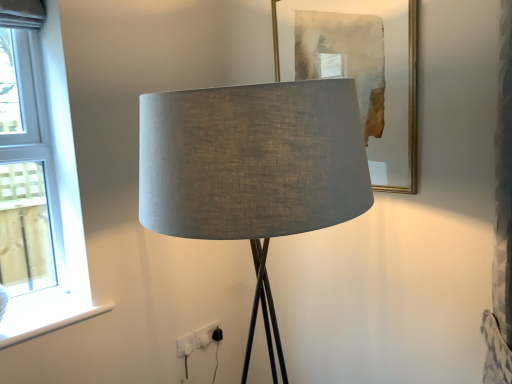
Question: Considering the relative sizes of white plastic electric outlet at lower center, acting as the 1th electric outlet starting from the front, and white smooth window sill at lower left in the image provided, is white plastic electric outlet at lower center, acting as the 1th electric outlet starting from the front, wider than white smooth window sill at lower left?

Choices:
 (A) yes
 (B) no

Answer: (B)

Question: Does white plastic electric outlet at lower center, the second electric outlet from the back, come in front of white smooth window sill at lower left?

Choices:
 (A) no
 (B) yes

Answer: (A)

Question: Is white plastic electric outlet at lower center, which ranks as the 2th electric outlet in right-to-left order, behind white smooth window sill at lower left?

Choices:
 (A) no
 (B) yes

Answer: (B)

Question: Is white plastic electric outlet at lower center, which ranks as the 2th electric outlet in right-to-left order, thinner than white smooth window sill at lower left?

Choices:
 (A) yes
 (B) no

Answer: (A)

Question: Considering the relative sizes of white plastic electric outlet at lower center, which ranks as the 2th electric outlet in right-to-left order, and white smooth window sill at lower left in the image provided, is white plastic electric outlet at lower center, which ranks as the 2th electric outlet in right-to-left order, bigger than white smooth window sill at lower left?

Choices:
 (A) yes
 (B) no

Answer: (B)

Question: Is white plastic electric outlet at lower center, which ranks as the 2th electric outlet in right-to-left order, facing away from white smooth window sill at lower left?

Choices:
 (A) no
 (B) yes

Answer: (A)

Question: Would you say matte gray fabric lamp at center is outside white plastic electric outlet at lower center, the first electric outlet when ordered from right to left?

Choices:
 (A) yes
 (B) no

Answer: (A)

Question: Is matte gray fabric lamp at center far away from white plastic electric outlet at lower center, the 2th electric outlet positioned from the left?

Choices:
 (A) yes
 (B) no

Answer: (A)

Question: Considering the relative positions of matte gray fabric lamp at center and white plastic electric outlet at lower center, the first electric outlet when ordered from right to left, in the image provided, is matte gray fabric lamp at center to the left of white plastic electric outlet at lower center, the first electric outlet when ordered from right to left, from the viewer's perspective?

Choices:
 (A) no
 (B) yes

Answer: (A)

Question: Can you confirm if matte gray fabric lamp at center is taller than white plastic electric outlet at lower center, acting as the 2th electric outlet starting from the front?

Choices:
 (A) yes
 (B) no

Answer: (A)

Question: Is matte gray fabric lamp at center thinner than white plastic electric outlet at lower center, acting as the 2th electric outlet starting from the front?

Choices:
 (A) yes
 (B) no

Answer: (B)

Question: Is matte gray fabric lamp at center oriented towards white plastic electric outlet at lower center, the 1th electric outlet in the back-to-front sequence?

Choices:
 (A) no
 (B) yes

Answer: (A)

Question: Does white smooth window sill at lower left touch gold-framed mirror at upper center?

Choices:
 (A) no
 (B) yes

Answer: (A)